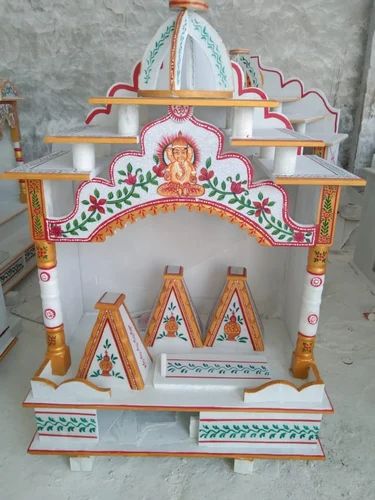
Locate an element on the screen. This screenshot has width=375, height=500. board is located at coordinates (330, 180), (46, 178), (80, 133), (246, 100), (283, 137), (187, 398).